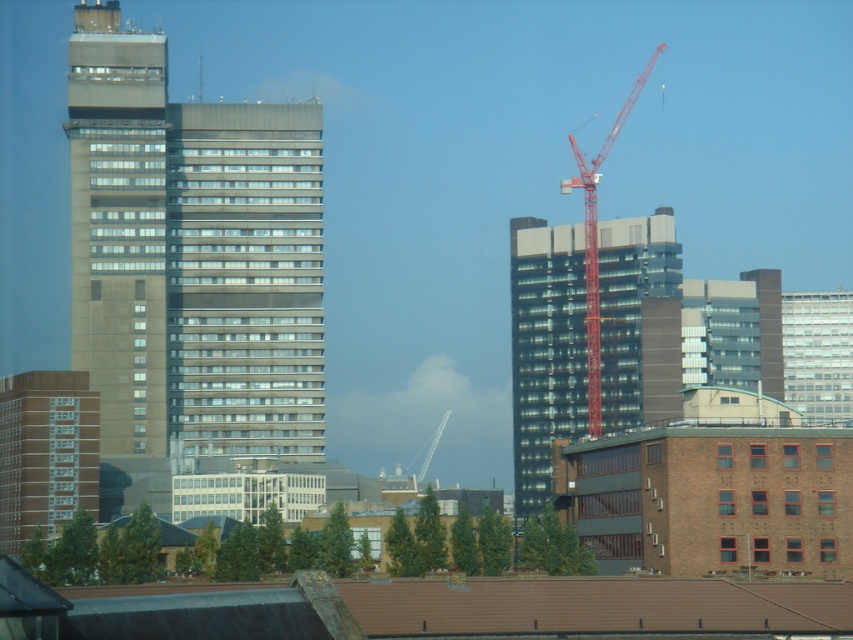
You are a city planner evaluating the urban layout. You need to determine which of the two buildings, the concrete building at left or the brown brick building at lower left, has a greater footprint to accommodate more commercial spaces. Based on the scene, which building should you prioritize?

The concrete building at left is larger in size than the brown brick building at lower left, so it has a greater footprint and should be prioritized for accommodating more commercial spaces.

In the scene shown: You are a city planner reviewing this urban layout. You need to determine if the brown brick building at lower left can be seen from the observation deck of the red metal crane at upper right. Based on their heights, what is your conclusion?

The brown brick building at lower left is not as tall as the red metal crane at upper right, so the crane is taller. Since the crane is taller, its observation deck would be higher, allowing a view over the brown brick building at lower left. Therefore, the brown brick building at lower left can be seen from the observation deck of the red metal crane at upper right.

You are standing in the middle of the urban landscape and see the concrete building at left and the glassy black building at center. Which building is positioned to the left of the other?

The concrete building at left is to the left of the glassy black building at center.